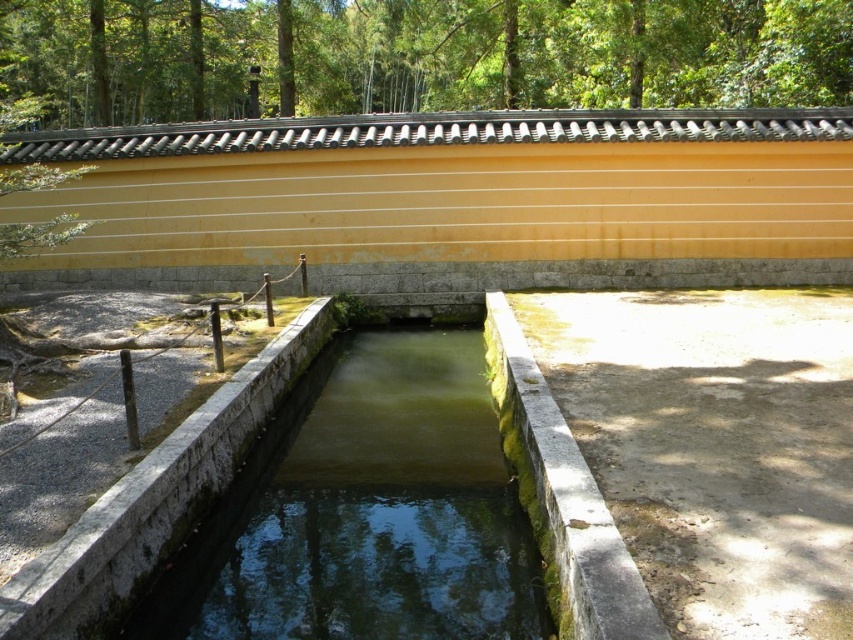
You are an architect designing a garden and want to place a new sculpture between the green leafy tree at upper center and the green mossy stone water at center. Which object should the sculpture be closer to if you want it to appear proportionally balanced with both?

The sculpture should be closer to the green mossy stone water at center because the green leafy tree at upper center is larger, so placing the sculpture closer to the smaller object helps achieve a balanced appearance.

You are a bird looking for a place to perch. You see the green leafy tree at upper center and the green mossy stone water at center. Which one is taller?

The green leafy tree at upper center is taller than the green mossy stone water at center.

You are standing in the serene outdoor scene and want to know which object is above the other. Which is higher in position between the green leafy tree at upper center and the green mossy stone water at center?

The green leafy tree at upper center is positioned over the green mossy stone water at center, so it is higher in position.